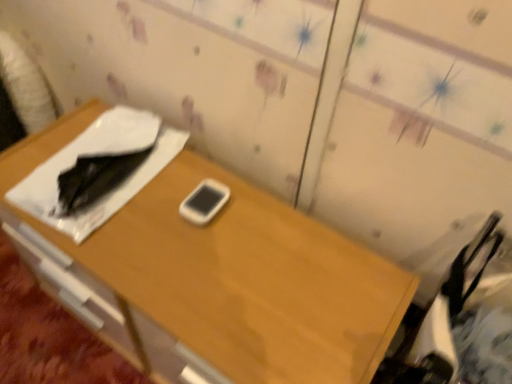
At what (x,y) coordinates should I click in order to perform the action: click on unoccupied space behind white matte mobile phone at center. Please return your answer as a coordinate pair (x, y). The image size is (512, 384). Looking at the image, I should click on (199, 171).